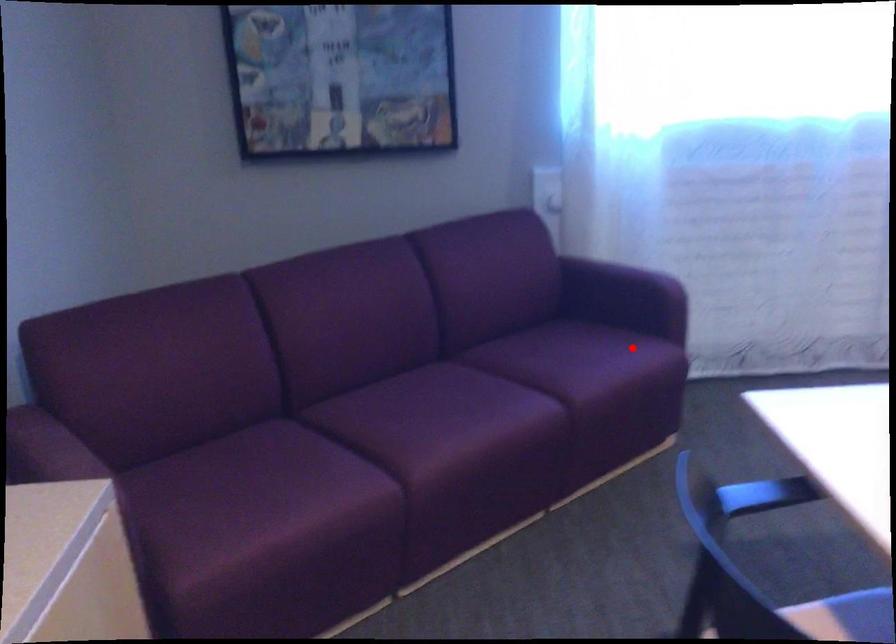
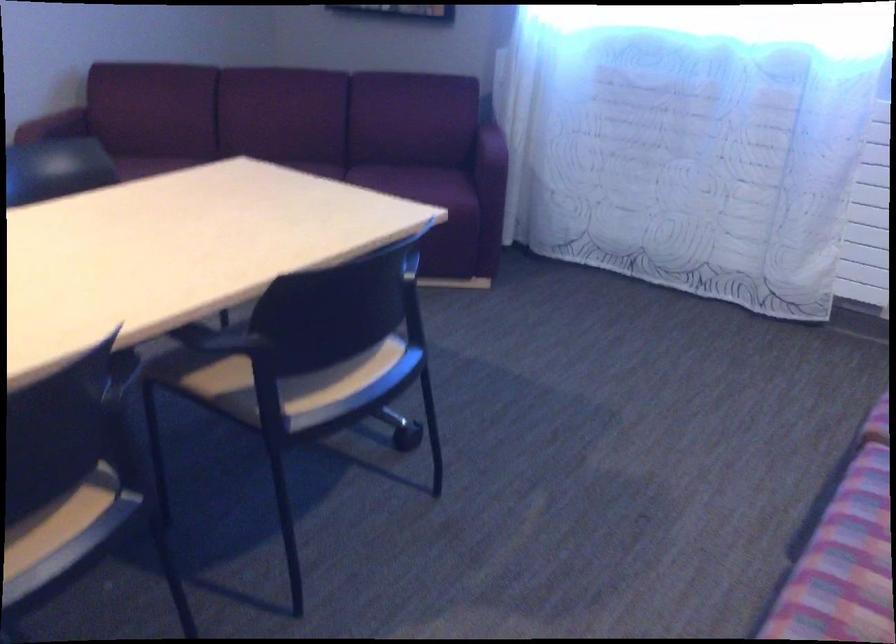
Question: I am providing you with two images of the same scene from different viewpoints. Image1 has a red point marked. In image2, the corresponding 3D location appears at what relative position? Reply with the corresponding letter.

Choices:
 (A) Closer
 (B) Farther

Answer: (B)